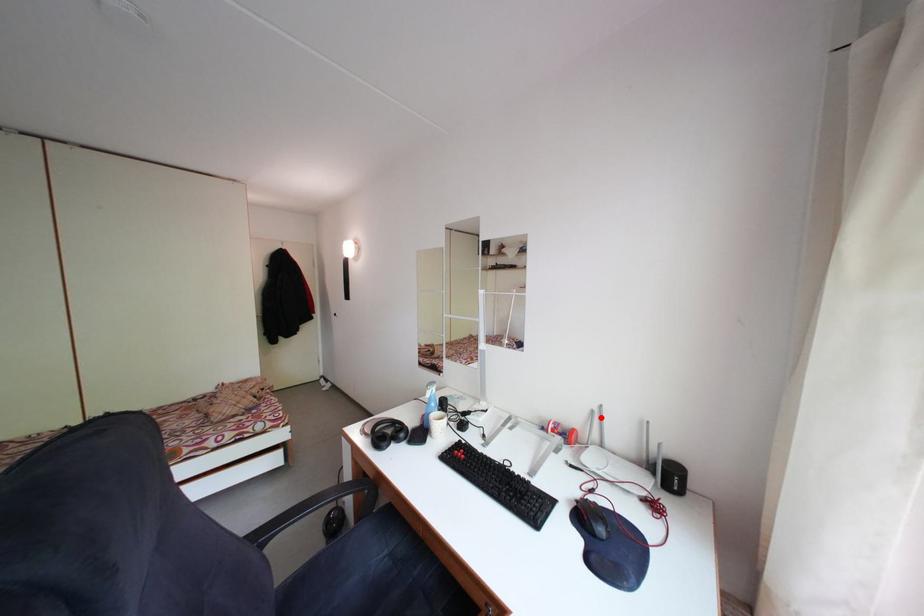
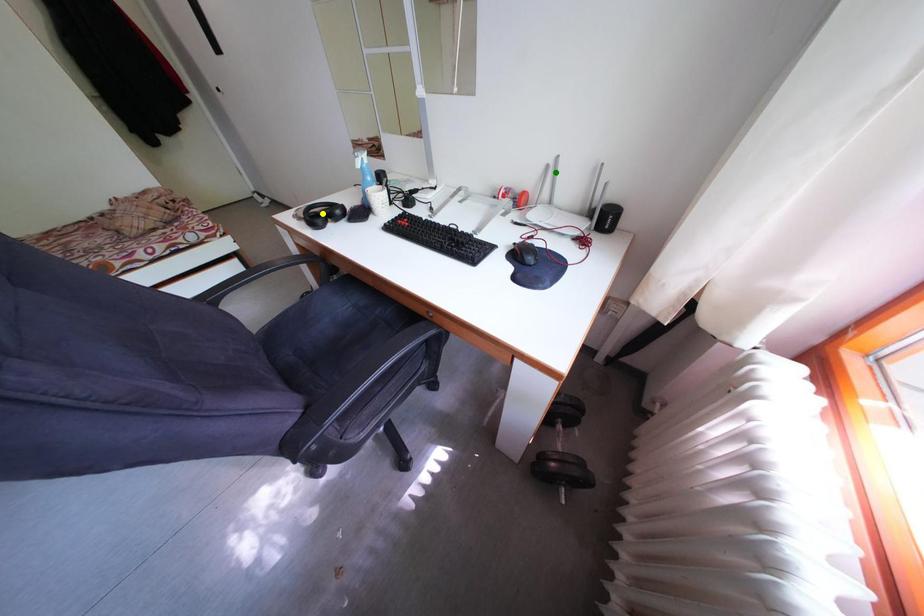
Question: I am providing you with two images of the same scene from different viewpoints. A red point is marked on the first image. You are given multiple points on the second image. Which mark in image 2 goes with the point in image 1?

Choices:
 (A) blue point
 (B) green point
 (C) yellow point

Answer: (B)